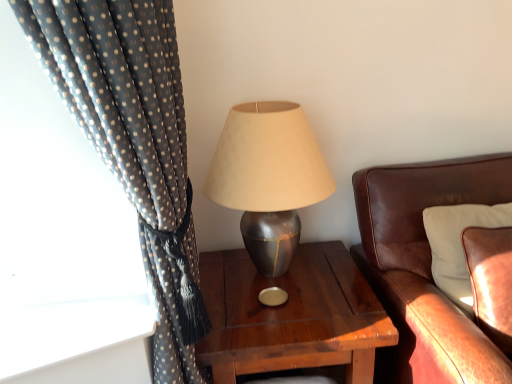
Question: Considering the relative sizes of polka dot fabric curtain at left and brown leather couch at right in the image provided, is polka dot fabric curtain at left taller than brown leather couch at right?

Choices:
 (A) no
 (B) yes

Answer: (B)

Question: Does polka dot fabric curtain at left touch brown leather couch at right?

Choices:
 (A) yes
 (B) no

Answer: (B)

Question: From a real-world perspective, is polka dot fabric curtain at left on brown leather couch at right?

Choices:
 (A) no
 (B) yes

Answer: (B)

Question: Does polka dot fabric curtain at left have a lesser height compared to brown leather couch at right?

Choices:
 (A) no
 (B) yes

Answer: (A)

Question: Is polka dot fabric curtain at left far from brown leather couch at right?

Choices:
 (A) no
 (B) yes

Answer: (A)

Question: Is point (164, 104) positioned closer to the camera than point (444, 271)?

Choices:
 (A) farther
 (B) closer

Answer: (B)

Question: In terms of width, does polka dot fabric curtain at left look wider or thinner when compared to leather cushion at right?

Choices:
 (A) thin
 (B) wide

Answer: (B)

Question: From a real-world perspective, is polka dot fabric curtain at left physically located above or below leather cushion at right?

Choices:
 (A) below
 (B) above

Answer: (B)

Question: Do you think polka dot fabric curtain at left is within leather cushion at right, or outside of it?

Choices:
 (A) inside
 (B) outside

Answer: (B)

Question: Which is correct: metallic gray lamp at center is inside brown leather couch at right, or outside of it?

Choices:
 (A) outside
 (B) inside

Answer: (A)

Question: From the image's perspective, is metallic gray lamp at center above or below brown leather couch at right?

Choices:
 (A) above
 (B) below

Answer: (A)

Question: Considering their positions, is metallic gray lamp at center located in front of or behind brown leather couch at right?

Choices:
 (A) behind
 (B) front

Answer: (A)

Question: From a real-world perspective, is metallic gray lamp at center positioned above or below brown leather couch at right?

Choices:
 (A) above
 (B) below

Answer: (A)

Question: Would you say leather cushion at right is inside or outside metallic gray lamp at center?

Choices:
 (A) outside
 (B) inside

Answer: (A)

Question: Considering the positions of leather cushion at right and metallic gray lamp at center in the image, is leather cushion at right taller or shorter than metallic gray lamp at center?

Choices:
 (A) tall
 (B) short

Answer: (B)